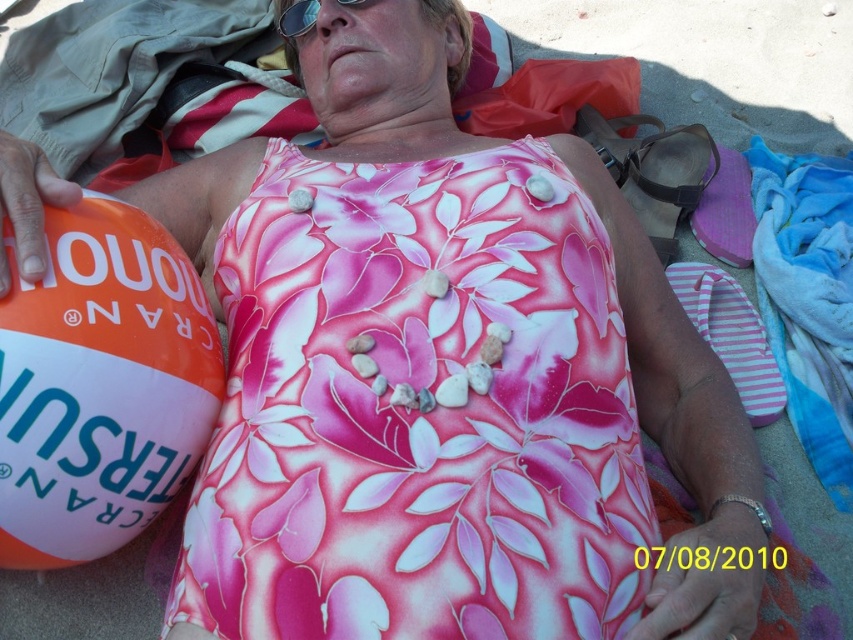
Question: Which of the following is the closest to the observer?

Choices:
 (A) orange/white plastic beach ball at left
 (B) sunglasses at upper center

Answer: (A)

Question: Is orange/white plastic beach ball at left to the left of sunglasses at upper center from the viewer's perspective?

Choices:
 (A) yes
 (B) no

Answer: (A)

Question: Is orange/white plastic beach ball at left to the right of sunglasses at upper center from the viewer's perspective?

Choices:
 (A) yes
 (B) no

Answer: (B)

Question: Is orange/white plastic beach ball at left wider than sunglasses at upper center?

Choices:
 (A) yes
 (B) no

Answer: (A)

Question: Which point is closer to the camera taking this photo?

Choices:
 (A) (276, 20)
 (B) (152, 394)

Answer: (B)